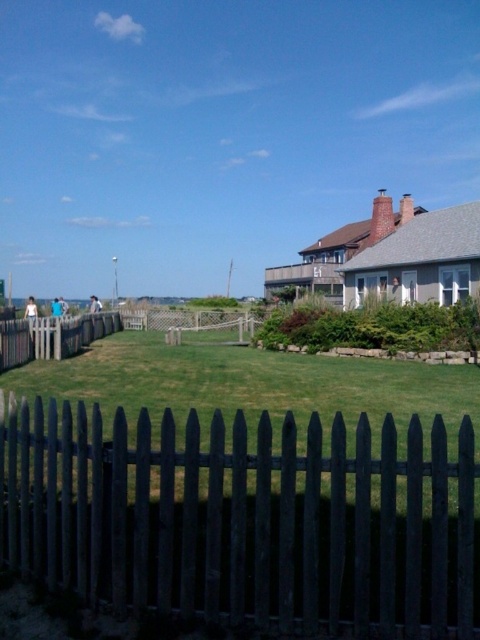
You are standing at the point marked as point (243, 522) in the image. What object are you facing?

The point (243, 522) indicates dark wood picket fence at center, so you are facing the dark wood picket fence at center.